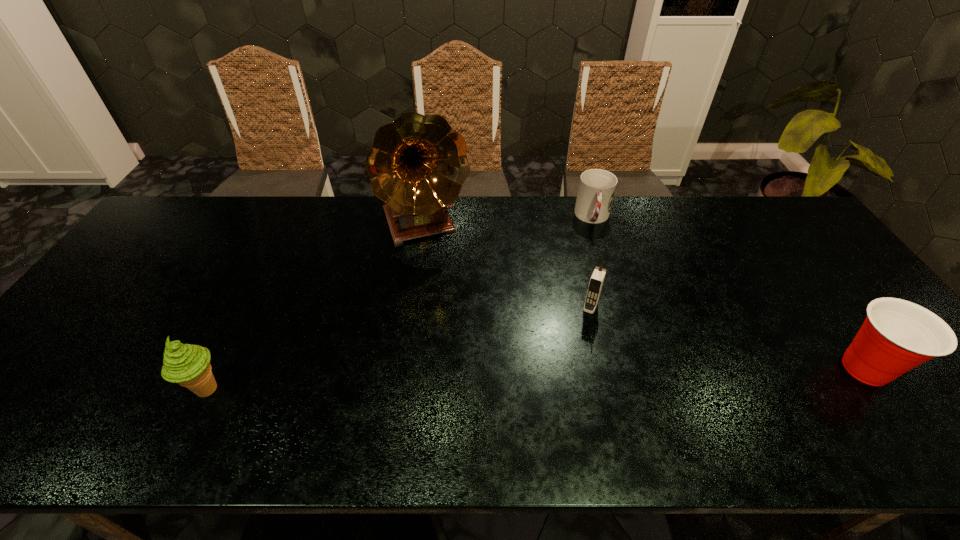
This screenshot has width=960, height=540. What are the coordinates of `empty location between the icecream and the rightmost object` in the screenshot? It's located at (537, 379).

Identify the location of free space between the cellular telephone and the icecream. (x=398, y=348).

You are a GUI agent. You are given a task and a screenshot of the screen. Output one action in this format:
    pyautogui.click(x=<x>, y=<y>)
    Task: Click on the blank region between the farther cup and the fourth object from right to left
    Image resolution: width=960 pixels, height=540 pixels.
    Given the screenshot: What is the action you would take?
    pyautogui.click(x=509, y=221)

Where is `free space that is in between the icecream and the cellular telephone`? This screenshot has height=540, width=960. free space that is in between the icecream and the cellular telephone is located at coordinates (398, 348).

Locate an element on the screen. The width and height of the screenshot is (960, 540). vacant area that lies between the third nearest object and the second shortest object is located at coordinates (728, 338).

Where is `blank region between the left cup and the tallest object`? The height and width of the screenshot is (540, 960). blank region between the left cup and the tallest object is located at coordinates (509, 221).

At what (x,y) coordinates should I click in order to perform the action: click on vacant space that's between the third farthest object and the leftmost object. Please return your answer as a coordinate pair (x, y). The image size is (960, 540). Looking at the image, I should click on (398, 348).

You are a GUI agent. You are given a task and a screenshot of the screen. Output one action in this format:
    pyautogui.click(x=<x>, y=<y>)
    Task: Click on the vacant region between the icecream and the shorter cup
    
    Given the screenshot: What is the action you would take?
    pyautogui.click(x=400, y=303)

Identify the location of unoccupied position between the right cup and the tallest object. (645, 296).

What are the coordinates of `free space between the third nearest object and the shortest object` in the screenshot? It's located at (591, 262).